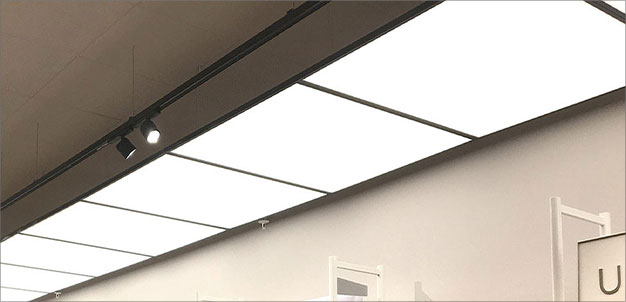
You are a GUI agent. You are given a task and a screenshot of the screen. Output one action in this format:
    pyautogui.click(x=<x>, y=<y>)
    Task: Click on the lights
    This screenshot has width=626, height=302.
    Given the screenshot: What is the action you would take?
    pyautogui.click(x=151, y=126), pyautogui.click(x=120, y=144), pyautogui.click(x=218, y=194), pyautogui.click(x=299, y=135), pyautogui.click(x=473, y=62), pyautogui.click(x=120, y=235), pyautogui.click(x=49, y=249), pyautogui.click(x=29, y=280), pyautogui.click(x=4, y=296)